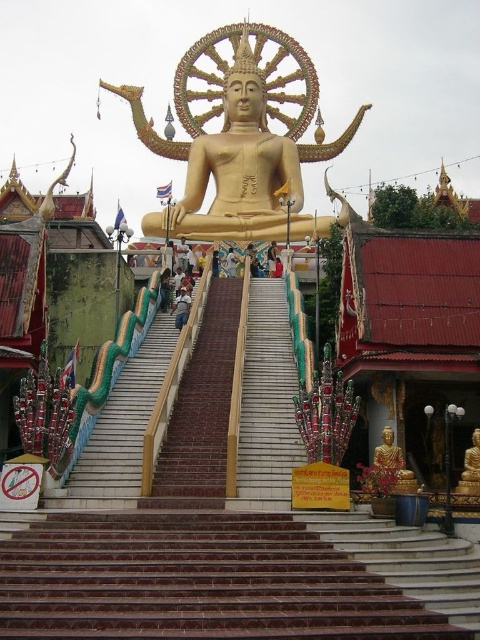
Question: Does white marble stairs at center appear on the right side of gold polished statue at center?

Choices:
 (A) yes
 (B) no

Answer: (B)

Question: Which point appears closest to the camera in this image?

Choices:
 (A) (276, 148)
 (B) (79, 614)

Answer: (B)

Question: Which object is farther from the camera taking this photo?

Choices:
 (A) white marble stairs at center
 (B) gold polished statue at center

Answer: (B)

Question: Is white marble stairs at center in front of gold polished statue at center?

Choices:
 (A) no
 (B) yes

Answer: (B)

Question: Which object appears farthest from the camera in this image?

Choices:
 (A) white marble stairs at center
 (B) gold polished statue at center

Answer: (B)

Question: Can you confirm if white marble stairs at center is bigger than gold polished statue at center?

Choices:
 (A) yes
 (B) no

Answer: (B)